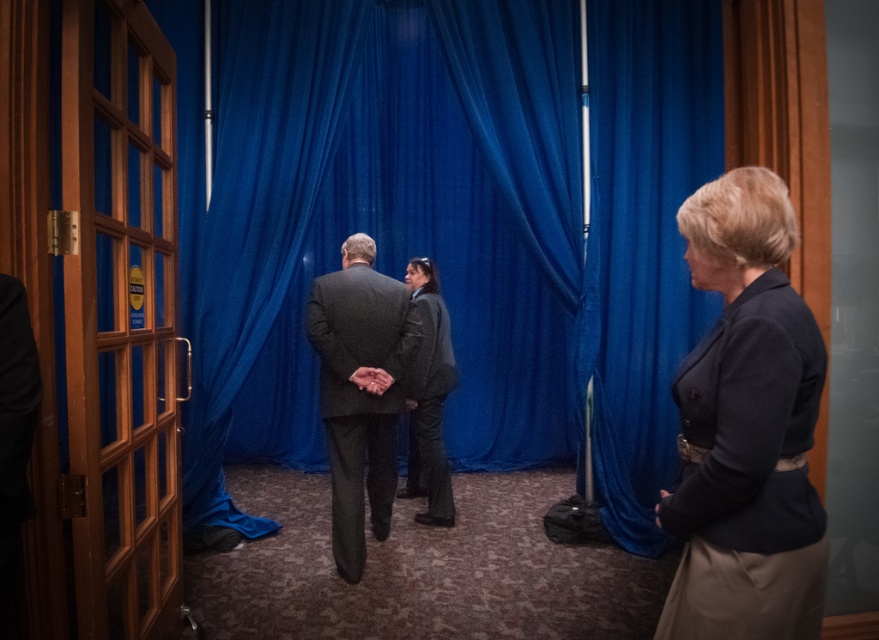
You are an interior designer assessing the space between two garments in the image. The dark gray wool blazer at right and the dark gray textured suit at center are both hanging on adjacent hangers. If you want to ensure they are spaced evenly, which garment requires more space between its hanger and the next one?

The dark gray textured suit at center requires more space between its hanger and the next one because it has a greater width compared to the dark gray wool blazer at right.

You are standing in the room and want to reach the blue velvet curtain at center to adjust its position. Considering your height is 1.7 meters, can you comfortably reach the curtain without needing a stool?

The blue velvet curtain at center is 4.73 meters away from the viewer. Since the distance is more than your height, you would need to move closer or use a stool to reach it comfortably.

You are standing in the scene and want to move from the point at coordinates point (95, 330) to the point at coordinates point (365, 280). Which direction should you move in to get closer to the blue curtain?

To move from point (95, 330) to point (365, 280), you should move towards the blue curtain since point (365, 280) is further away from the viewer compared to point (95, 330). Therefore, moving toward the curtain would take you in the correct direction.